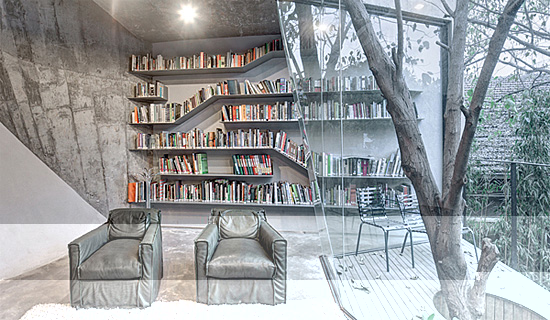
Find the location of a particular element. The height and width of the screenshot is (320, 550). wall is located at coordinates (52, 186).